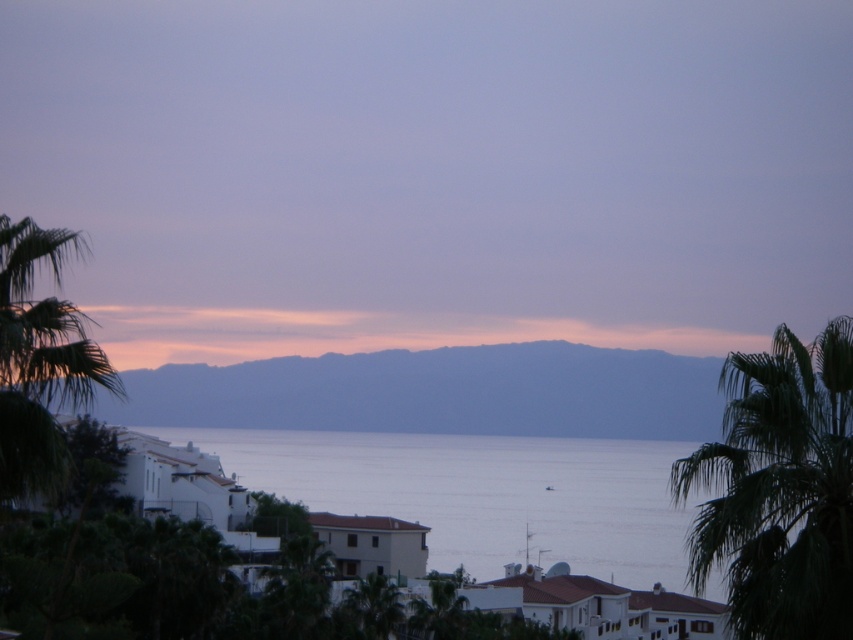
Question: Is blue water at center closer to the viewer compared to green leafy palm tree at right?

Choices:
 (A) no
 (B) yes

Answer: (A)

Question: Does blue water at center have a lesser width compared to dull blue sky at center?

Choices:
 (A) no
 (B) yes

Answer: (B)

Question: Does dull blue sky at center lie in front of green leafy palm tree at right?

Choices:
 (A) no
 (B) yes

Answer: (B)

Question: Considering the real-world distances, which object is farthest from the green leafy palm tree at left?

Choices:
 (A) blue water at center
 (B) green leafy palm tree at right

Answer: (A)

Question: Which point is closer to the camera taking this photo?

Choices:
 (A) (18, 464)
 (B) (224, 429)

Answer: (A)

Question: Which point appears closest to the camera in this image?

Choices:
 (A) (413, 465)
 (B) (807, 346)

Answer: (B)